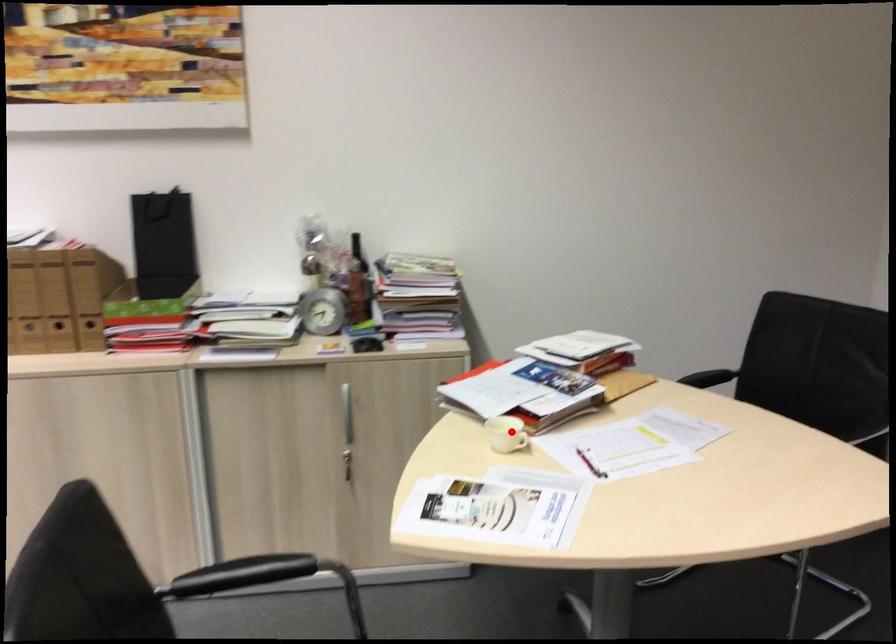
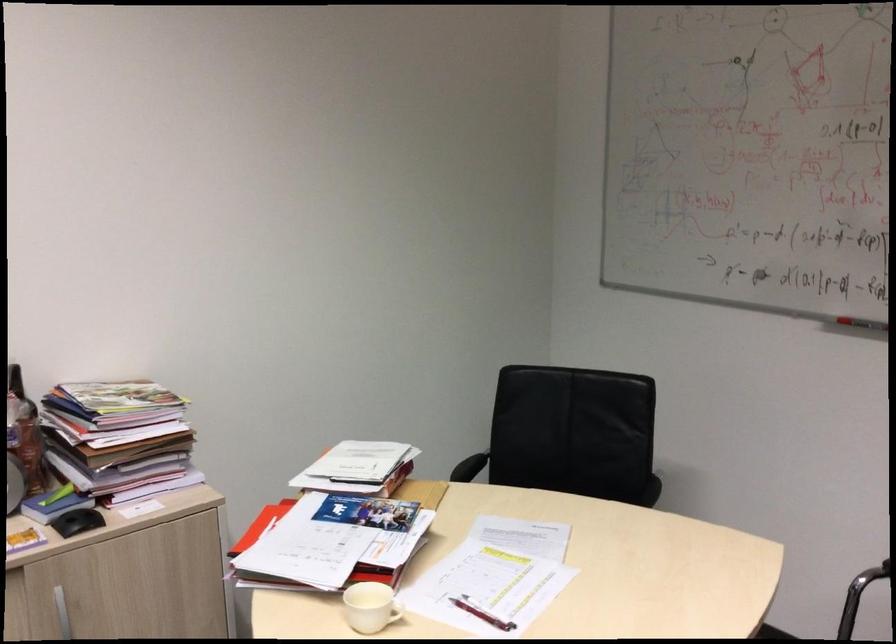
Find the pixel in the second image that matches the highlighted location in the first image.

(369, 607)